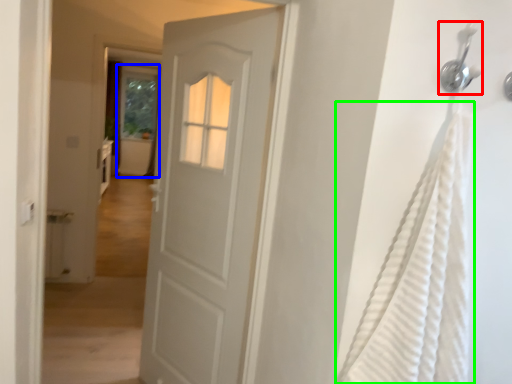
Question: Considering the real-world distances, which object is closest to shower (highlighted by a red box)? screen door (highlighted by a blue box) or shower curtain (highlighted by a green box).

Choices:
 (A) screen door
 (B) shower curtain

Answer: (B)